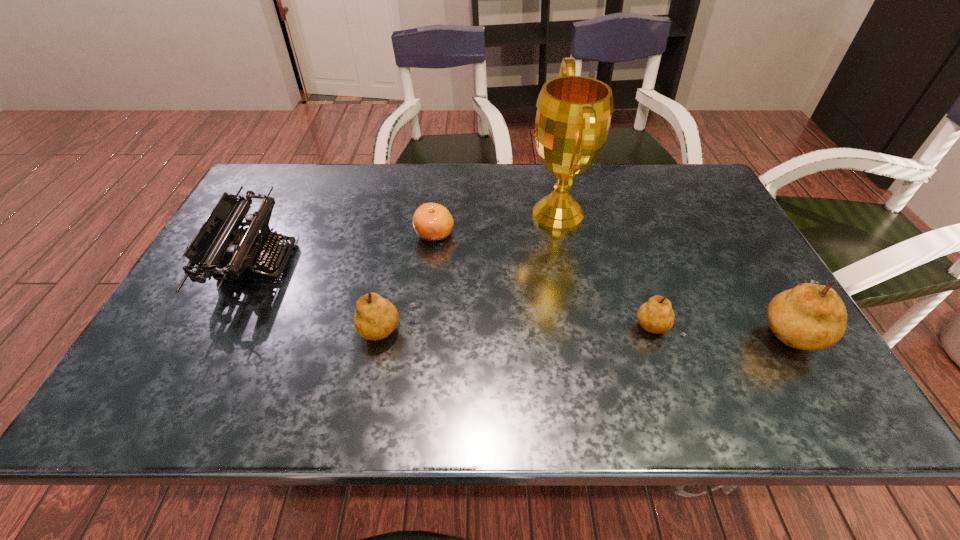
This screenshot has width=960, height=540. What are the coordinates of `the second shortest pear` in the screenshot? It's located at (376, 318).

Locate an element on the screen. The width and height of the screenshot is (960, 540). the second pear from left to right is located at coordinates (655, 316).

You are a GUI agent. You are given a task and a screenshot of the screen. Output one action in this format:
    pyautogui.click(x=<x>, y=<y>)
    Task: Click on the shortest pear
    The image size is (960, 540).
    Given the screenshot: What is the action you would take?
    pyautogui.click(x=655, y=316)

Locate an element on the screen. Image resolution: width=960 pixels, height=540 pixels. the rightmost pear is located at coordinates (809, 317).

Locate an element on the screen. the second tallest object is located at coordinates (809, 317).

Where is `the tallest object`? This screenshot has height=540, width=960. the tallest object is located at coordinates (573, 116).

This screenshot has height=540, width=960. Identify the location of the third object from right to left. (573, 116).

You are a GUI agent. You are given a task and a screenshot of the screen. Output one action in this format:
    pyautogui.click(x=<x>, y=<y>)
    Task: Click on the typewriter
    This screenshot has width=960, height=540.
    Given the screenshot: What is the action you would take?
    pyautogui.click(x=220, y=249)

Where is `clementine`? clementine is located at coordinates (433, 222).

Image resolution: width=960 pixels, height=540 pixels. Find the location of `free space located 0.150m on the back of the leftmost pear`. free space located 0.150m on the back of the leftmost pear is located at coordinates (398, 269).